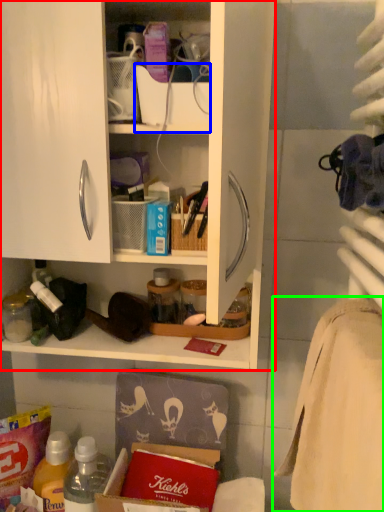
Question: Estimate the real-world distances between objects in this image. Which object is farther from cabinetry (highlighted by a red box), box (highlighted by a blue box) or bath towel (highlighted by a green box)?

Choices:
 (A) box
 (B) bath towel

Answer: (B)